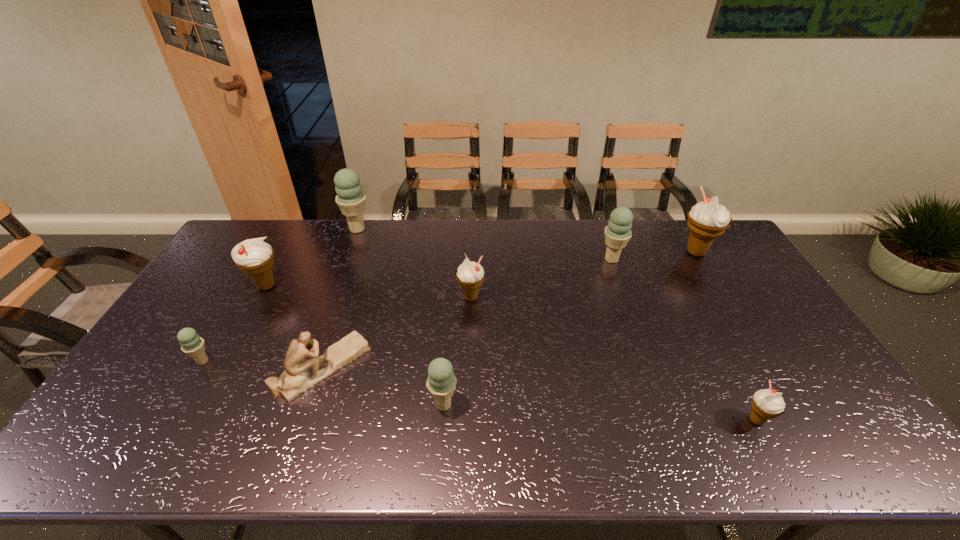
At what (x,y) coordinates should I click in order to perform the action: click on the farthest blue ice cream. Please return your answer as a coordinate pair (x, y). Image resolution: width=960 pixels, height=540 pixels. Looking at the image, I should click on (350, 199).

Locate an element on the screen. the farthest object is located at coordinates (350, 199).

Image resolution: width=960 pixels, height=540 pixels. Find the location of `the farthest white icecream`. the farthest white icecream is located at coordinates (707, 220).

The image size is (960, 540). In order to click on the sixth icecream from left to right in this screenshot , I will do `click(618, 232)`.

Where is `the second farthest blue ice cream`? the second farthest blue ice cream is located at coordinates (618, 232).

Find the location of `the second biggest white icecream`. the second biggest white icecream is located at coordinates (254, 257).

The width and height of the screenshot is (960, 540). Find the location of `the second white icecream from left to right`. the second white icecream from left to right is located at coordinates (470, 275).

Locate an element on the screen. This screenshot has width=960, height=540. the nearest blue ice cream is located at coordinates (441, 382).

I want to click on the third blue ice cream from left to right, so click(441, 382).

The height and width of the screenshot is (540, 960). Find the location of `figurine`. figurine is located at coordinates (304, 369).